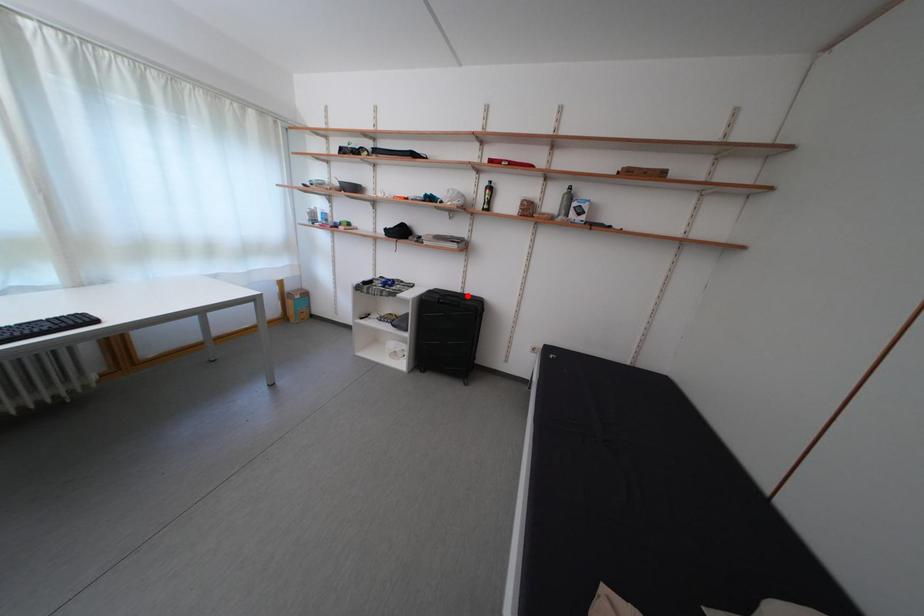
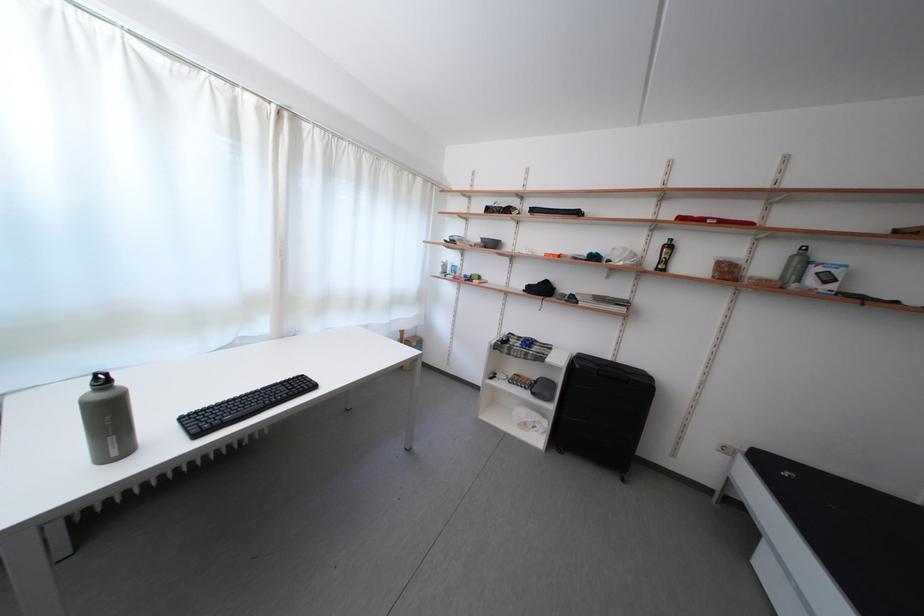
In the second image, find the point that corresponds to the highlighted location in the first image.

(617, 363)